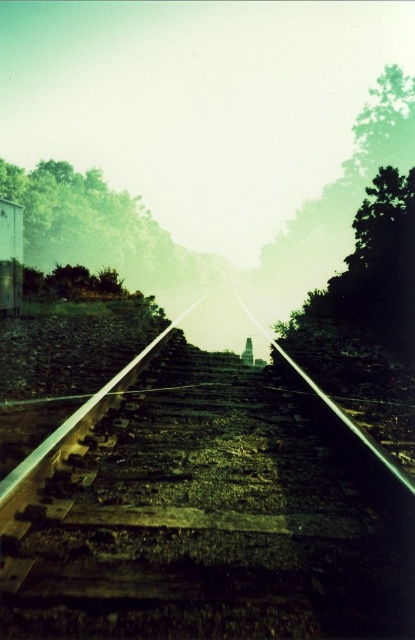
Question: Which point is farther to the camera?

Choices:
 (A) green leafy tree at right
 (B) green leafy tree at upper left
 (C) smooth metal train track at center
 (D) green leafy tree at upper right

Answer: (D)

Question: Estimate the real-world distances between objects in this image. Which object is closer to the smooth metal train track at center?

Choices:
 (A) green leafy tree at upper right
 (B) green leafy tree at upper left

Answer: (B)

Question: Which point is farther from the camera taking this photo?

Choices:
 (A) (356, 193)
 (B) (92, 268)
 (C) (31, 493)

Answer: (A)

Question: Can you confirm if smooth metal train track at center is bigger than green leafy tree at upper left?

Choices:
 (A) no
 (B) yes

Answer: (A)

Question: Can you confirm if green leafy tree at upper left is positioned to the right of green leafy tree at upper right?

Choices:
 (A) yes
 (B) no

Answer: (B)

Question: Is green leafy tree at right smaller than green leafy tree at upper right?

Choices:
 (A) yes
 (B) no

Answer: (A)